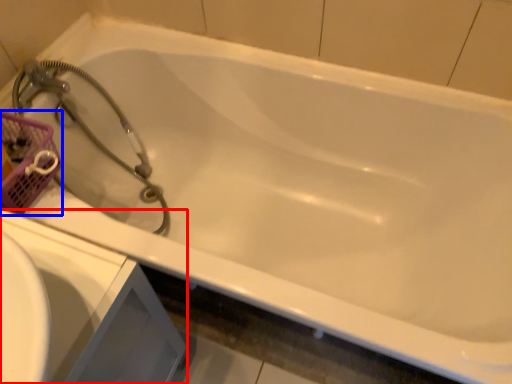
Question: Which point is closer to the camera, sink (highlighted by a red box) or basket (highlighted by a blue box)?

Choices:
 (A) sink
 (B) basket

Answer: (A)